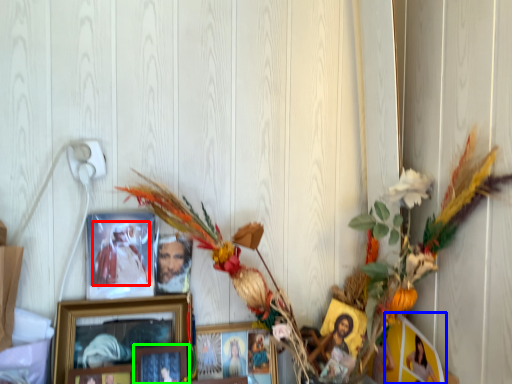
Question: Based on their relative distances, which object is farther from person (highlighted by a red box)? Choose from picture frame (highlighted by a blue box) and picture frame (highlighted by a green box).

Choices:
 (A) picture frame
 (B) picture frame

Answer: (A)